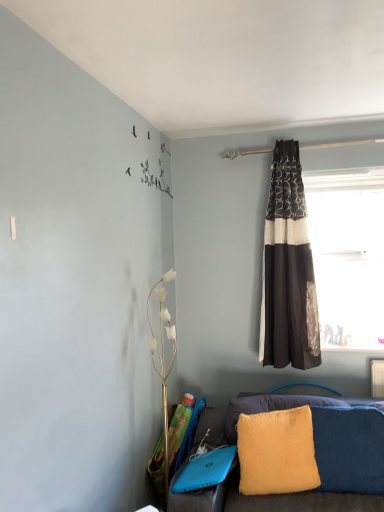
Describe the element at coordinates (348, 255) in the screenshot. I see `transparent glass window at upper right` at that location.

The height and width of the screenshot is (512, 384). In order to click on black textured curtain at right in this screenshot , I will do `click(288, 270)`.

Where is `transparent glass window at upper right`? The image size is (384, 512). transparent glass window at upper right is located at coordinates (348, 255).

Is fuzzy yellow pillow at lower right at the back of black textured curtain at right?

black textured curtain at right does not have its back to fuzzy yellow pillow at lower right.

From the image's perspective, who appears lower, black textured curtain at right or fuzzy yellow pillow at lower right?

fuzzy yellow pillow at lower right appears lower in the image.

What's the angular difference between black textured curtain at right and fuzzy yellow pillow at lower right's facing directions?

The facing directions of black textured curtain at right and fuzzy yellow pillow at lower right are 18.2 degrees apart.

The height and width of the screenshot is (512, 384). I want to click on pillow below the black textured curtain at right (from the image's perspective), so click(x=277, y=452).

Could you tell me if fuzzy yellow pillow at lower right is turned towards transparent glass window at upper right?

No, fuzzy yellow pillow at lower right is not facing towards transparent glass window at upper right.

Considering the positions of objects fuzzy yellow pillow at lower right and transparent glass window at upper right in the image provided, who is more to the right, fuzzy yellow pillow at lower right or transparent glass window at upper right?

transparent glass window at upper right is more to the right.

Can you confirm if fuzzy yellow pillow at lower right is wider than transparent glass window at upper right?

Yes, fuzzy yellow pillow at lower right is wider than transparent glass window at upper right.

From a real-world perspective, is fuzzy yellow pillow at lower right under transparent glass window at upper right?

Yes, from a real-world perspective, fuzzy yellow pillow at lower right is below transparent glass window at upper right.

Which is behind, black textured curtain at right or transparent glass window at upper right?

transparent glass window at upper right is more distant.

From the image's perspective, between black textured curtain at right and transparent glass window at upper right, who is located below?

transparent glass window at upper right is shown below in the image.

Is transparent glass window at upper right at the back of black textured curtain at right?

black textured curtain at right does not have its back to transparent glass window at upper right.

Between black textured curtain at right and transparent glass window at upper right, which one appears on the right side from the viewer's perspective?

transparent glass window at upper right.

Which of these two, fuzzy yellow pillow at lower right or black textured curtain at right, is wider?

With larger width is black textured curtain at right.

From a real-world perspective, is fuzzy yellow pillow at lower right positioned above or below black textured curtain at right?

Clearly, from a real-world perspective, fuzzy yellow pillow at lower right is below black textured curtain at right.

From the image's perspective, relative to black textured curtain at right, is fuzzy yellow pillow at lower right above or below?

Based on their image positions, fuzzy yellow pillow at lower right is located beneath black textured curtain at right.

Consider the image. Which point is more forward, (242, 490) or (276, 306)?

The point (242, 490) is more forward.

Between transparent glass window at upper right and fuzzy yellow pillow at lower right, which one has smaller size?

With smaller size is fuzzy yellow pillow at lower right.

From a real-world perspective, which is physically below, transparent glass window at upper right or fuzzy yellow pillow at lower right?

In real-world perspective, fuzzy yellow pillow at lower right is lower.

Is transparent glass window at upper right facing away from fuzzy yellow pillow at lower right?

No, fuzzy yellow pillow at lower right is not at the back of transparent glass window at upper right.

Is transparent glass window at upper right shorter than fuzzy yellow pillow at lower right?

Incorrect, the height of transparent glass window at upper right does not fall short of that of fuzzy yellow pillow at lower right.

I want to click on window on the right side of black textured curtain at right, so point(348,255).

Is black textured curtain at right at the back of transparent glass window at upper right?

That's not correct — transparent glass window at upper right is not looking away from black textured curtain at right.

Is black textured curtain at right surrounded by transparent glass window at upper right?

No, black textured curtain at right is not inside transparent glass window at upper right.

Considering the positions of objects transparent glass window at upper right and black textured curtain at right in the image provided, who is in front, transparent glass window at upper right or black textured curtain at right?

black textured curtain at right is in front.

At what (x,y) coordinates should I click in order to perform the action: click on pillow that appears below the black textured curtain at right (from a real-world perspective). Please return your answer as a coordinate pair (x, y). Image resolution: width=384 pixels, height=512 pixels. Looking at the image, I should click on (277, 452).

I want to click on window above the fuzzy yellow pillow at lower right (from a real-world perspective), so click(348, 255).

From the image, which object appears to be nearer to fuzzy yellow pillow at lower right, transparent glass window at upper right or black textured curtain at right?

black textured curtain at right lies closer to fuzzy yellow pillow at lower right than the other object.

From the image, which object appears to be nearer to black textured curtain at right, transparent glass window at upper right or fuzzy yellow pillow at lower right?

transparent glass window at upper right.

Looking at the image, which one is located closer to transparent glass window at upper right, black textured curtain at right or fuzzy yellow pillow at lower right?

Based on the image, black textured curtain at right appears to be nearer to transparent glass window at upper right.

Looking at this image, considering their positions, is black textured curtain at right positioned further to fuzzy yellow pillow at lower right than transparent glass window at upper right?

The object further to fuzzy yellow pillow at lower right is transparent glass window at upper right.

Based on their spatial positions, is fuzzy yellow pillow at lower right or black textured curtain at right further from transparent glass window at upper right?

The object further to transparent glass window at upper right is fuzzy yellow pillow at lower right.

Based on their spatial positions, is fuzzy yellow pillow at lower right or transparent glass window at upper right closer to black textured curtain at right?

transparent glass window at upper right.

Locate an element on the screen. window between black textured curtain at right and fuzzy yellow pillow at lower right from top to bottom is located at coordinates (348, 255).